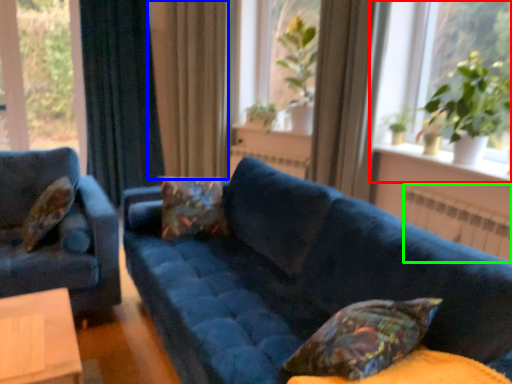
Question: Which object is positioned closest to window (highlighted by a red box)? Select from curtain (highlighted by a blue box) and radiator (highlighted by a green box).

Choices:
 (A) curtain
 (B) radiator

Answer: (B)